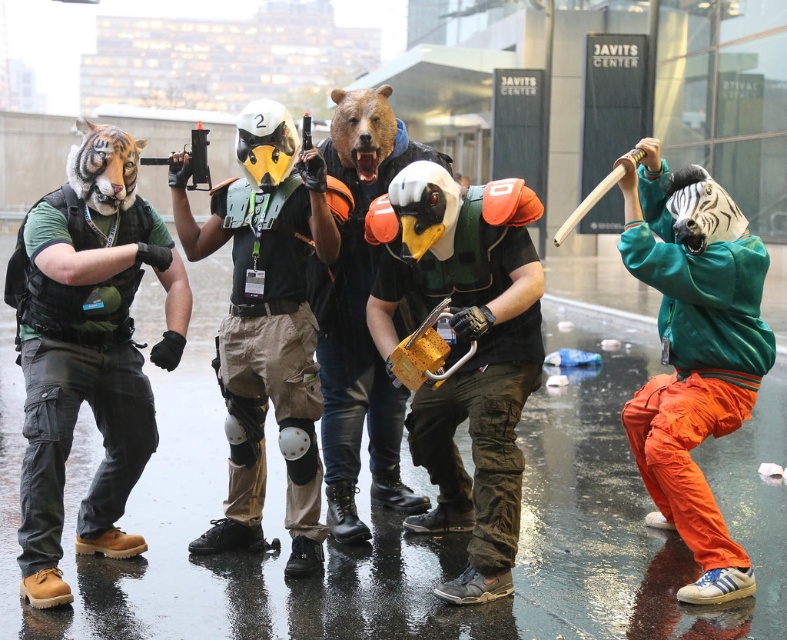
Question: Does matte green helmet at center have a greater width compared to velvet green hoodie at right?

Choices:
 (A) yes
 (B) no

Answer: (A)

Question: Which point is farther from the camera taking this photo?

Choices:
 (A) (501, 244)
 (B) (368, 164)
 (C) (259, 195)

Answer: (B)

Question: Which point is closer to the camera taking this photo?

Choices:
 (A) (320, 188)
 (B) (23, 508)
 (C) (467, 268)

Answer: (B)

Question: Can you confirm if matte black helmet at center is bigger than brown matte bear mask at center?

Choices:
 (A) no
 (B) yes

Answer: (A)

Question: Estimate the real-world distances between objects in this image. Which object is closer to the matte black helmet at center?

Choices:
 (A) velvet green hoodie at right
 (B) matte black vest at left

Answer: (B)

Question: Is matte green helmet at center closer to camera compared to velvet green hoodie at right?

Choices:
 (A) yes
 (B) no

Answer: (B)